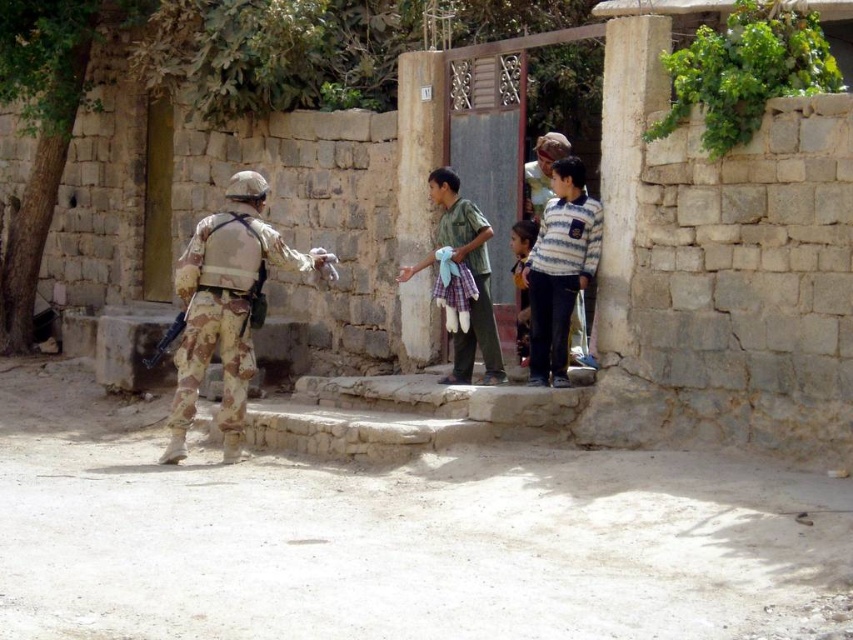
Question: Estimate the real-world distances between objects in this image. Which object is farther from the camouflage uniform at left?

Choices:
 (A) striped cotton shirt at center
 (B) light brown fabric shirt at center

Answer: (B)

Question: Is camouflage uniform at left positioned at the back of light brown fabric shirt at center?

Choices:
 (A) yes
 (B) no

Answer: (B)

Question: Which of the following is the closest to the observer?

Choices:
 (A) light brown fabric shirt at center
 (B) green plaid shorts at center
 (C) striped cotton shirt at center
 (D) camouflage uniform at left

Answer: (D)

Question: Is camouflage uniform at left positioned in front of light brown fabric shirt at center?

Choices:
 (A) yes
 (B) no

Answer: (A)

Question: Is green plaid shorts at center smaller than light brown fabric shirt at center?

Choices:
 (A) yes
 (B) no

Answer: (B)

Question: Which object appears closest to the camera in this image?

Choices:
 (A) green plaid shorts at center
 (B) light brown fabric shirt at center

Answer: (B)